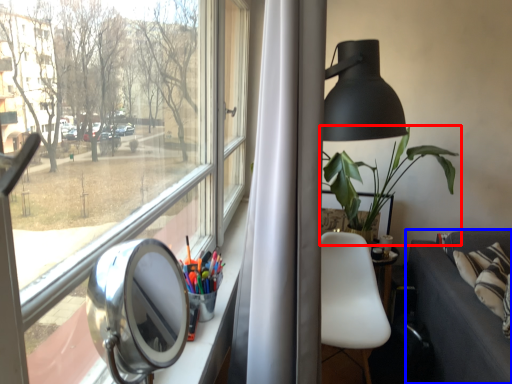
Question: Which of the following is the closest to the observer, houseplant (highlighted by a red box) or studio couch (highlighted by a blue box)?

Choices:
 (A) houseplant
 (B) studio couch

Answer: (B)